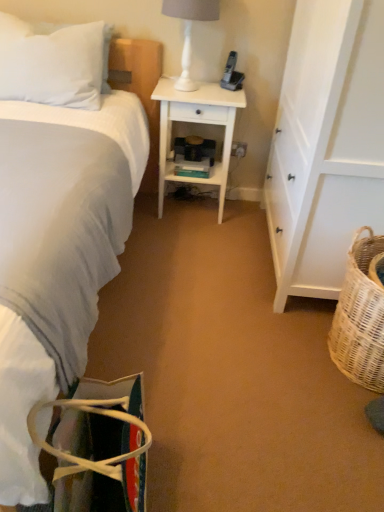
Question: From the image's perspective, would you say woven wicker basket at lower right is positioned over white soft bed at left?

Choices:
 (A) no
 (B) yes

Answer: (A)

Question: Are woven wicker basket at lower right and white soft bed at left located far from each other?

Choices:
 (A) no
 (B) yes

Answer: (A)

Question: From a real-world perspective, is woven wicker basket at lower right positioned over white soft bed at left based on gravity?

Choices:
 (A) yes
 (B) no

Answer: (B)

Question: Can you confirm if woven wicker basket at lower right is thinner than white soft bed at left?

Choices:
 (A) yes
 (B) no

Answer: (A)

Question: Is the position of woven wicker basket at lower right less distant than that of white soft bed at left?

Choices:
 (A) no
 (B) yes

Answer: (A)

Question: Is woven wicker basket at lower right with white soft bed at left?

Choices:
 (A) yes
 (B) no

Answer: (B)

Question: From the image's perspective, does multicolored fabric bag at lower left appear higher than woven wicker basket at lower right?

Choices:
 (A) yes
 (B) no

Answer: (B)

Question: Is the position of multicolored fabric bag at lower left less distant than that of woven wicker basket at lower right?

Choices:
 (A) no
 (B) yes

Answer: (B)

Question: Is multicolored fabric bag at lower left not inside woven wicker basket at lower right?

Choices:
 (A) no
 (B) yes

Answer: (B)

Question: Can you confirm if multicolored fabric bag at lower left is taller than woven wicker basket at lower right?

Choices:
 (A) no
 (B) yes

Answer: (A)

Question: Considering the relative sizes of multicolored fabric bag at lower left and woven wicker basket at lower right in the image provided, is multicolored fabric bag at lower left bigger than woven wicker basket at lower right?

Choices:
 (A) yes
 (B) no

Answer: (B)

Question: From the image's perspective, is multicolored fabric bag at lower left beneath woven wicker basket at lower right?

Choices:
 (A) yes
 (B) no

Answer: (A)

Question: Considering the relative sizes of white soft pillow at upper left and white wood desk at center in the image provided, is white soft pillow at upper left taller than white wood desk at center?

Choices:
 (A) yes
 (B) no

Answer: (B)